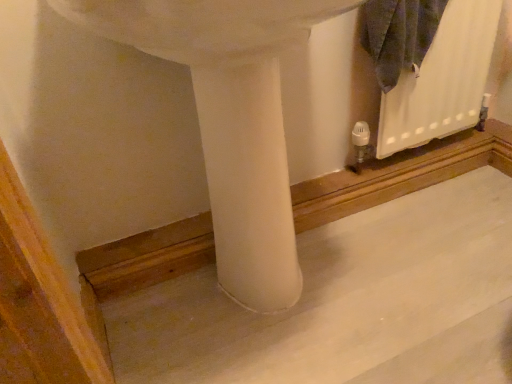
Question: Considering the relative sizes of white matte sink at center and white matte radiator at upper right in the image provided, is white matte sink at center shorter than white matte radiator at upper right?

Choices:
 (A) yes
 (B) no

Answer: (B)

Question: Can you confirm if white matte sink at center is taller than white matte radiator at upper right?

Choices:
 (A) yes
 (B) no

Answer: (A)

Question: Does white matte sink at center have a smaller size compared to white matte radiator at upper right?

Choices:
 (A) no
 (B) yes

Answer: (A)

Question: Considering the relative sizes of white matte sink at center and white matte radiator at upper right in the image provided, is white matte sink at center wider than white matte radiator at upper right?

Choices:
 (A) yes
 (B) no

Answer: (A)

Question: Is white matte sink at center at the left side of white matte radiator at upper right?

Choices:
 (A) yes
 (B) no

Answer: (A)

Question: In the image, is white matte sink at center on the left side or the right side of white matte radiator at upper right?

Choices:
 (A) left
 (B) right

Answer: (A)

Question: From a real-world perspective, relative to white matte radiator at upper right, is white matte sink at center vertically above or below?

Choices:
 (A) below
 (B) above

Answer: (B)

Question: From the image's perspective, is white matte sink at center positioned above or below white matte radiator at upper right?

Choices:
 (A) above
 (B) below

Answer: (B)

Question: Considering the positions of white matte sink at center and white matte radiator at upper right in the image, is white matte sink at center wider or thinner than white matte radiator at upper right?

Choices:
 (A) thin
 (B) wide

Answer: (B)

Question: Based on their sizes in the image, would you say white matte radiator at upper right is bigger or smaller than smooth concrete at center?

Choices:
 (A) big
 (B) small

Answer: (B)

Question: Considering the positions of white matte radiator at upper right and smooth concrete at center in the image, is white matte radiator at upper right taller or shorter than smooth concrete at center?

Choices:
 (A) short
 (B) tall

Answer: (B)

Question: From the image's perspective, is white matte radiator at upper right located above or below smooth concrete at center?

Choices:
 (A) above
 (B) below

Answer: (A)

Question: Is point click(458, 64) closer or farther from the camera than point click(359, 244)?

Choices:
 (A) farther
 (B) closer

Answer: (A)

Question: From the image's perspective, is smooth concrete at center positioned above or below white matte radiator at upper right?

Choices:
 (A) below
 (B) above

Answer: (A)

Question: In terms of width, does smooth concrete at center look wider or thinner when compared to white matte radiator at upper right?

Choices:
 (A) thin
 (B) wide

Answer: (B)